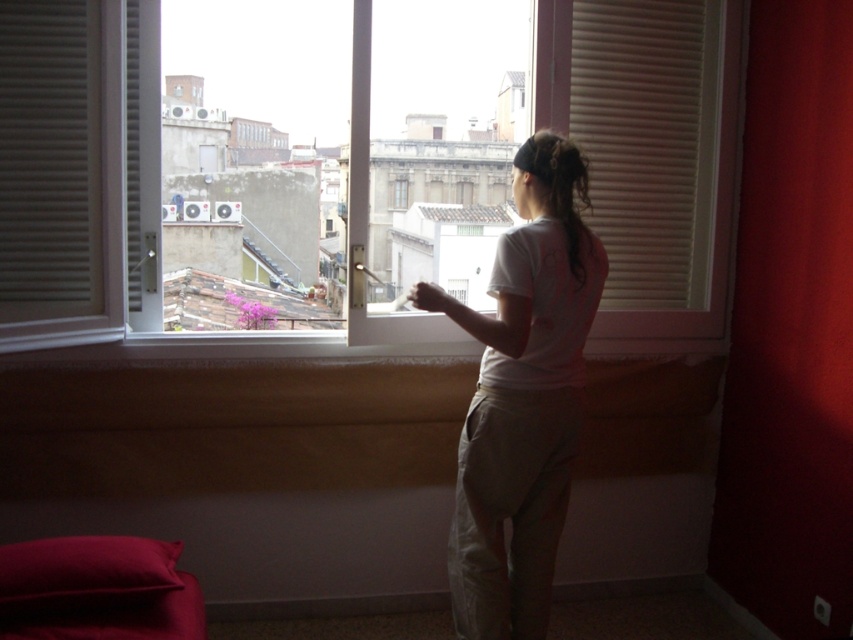
Consider the image. Does beige matte blinds at right have a larger size compared to dark brown hair at upper center?

Yes, beige matte blinds at right is bigger than dark brown hair at upper center.

Identify the location of beige matte blinds at right. The height and width of the screenshot is (640, 853). [646, 140].

This screenshot has width=853, height=640. In order to click on beige matte blinds at right in this screenshot , I will do `click(646, 140)`.

Which of these two, matte white blinds at left or transparent glass window at center, stands shorter?

Standing shorter between the two is transparent glass window at center.

Is point (22, 236) positioned behind point (398, 195)?

No, (22, 236) is in front of (398, 195).

The height and width of the screenshot is (640, 853). Describe the element at coordinates (49, 157) in the screenshot. I see `matte white blinds at left` at that location.

The image size is (853, 640). I want to click on matte white blinds at left, so click(x=49, y=157).

Based on the photo, which is below, dark brown hair at upper center or transparent glass window at center?

dark brown hair at upper center is below.

Is dark brown hair at upper center behind transparent glass window at center?

No, it is not.

Who is more forward, (577, 280) or (405, 205)?

Point (577, 280)

The width and height of the screenshot is (853, 640). In order to click on dark brown hair at upper center in this screenshot , I will do `click(566, 193)`.